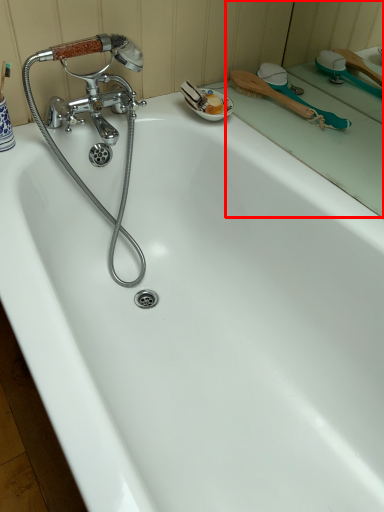
Question: In this image, where is mirror (annotated by the red box) located relative to shower?

Choices:
 (A) left
 (B) right

Answer: (B)